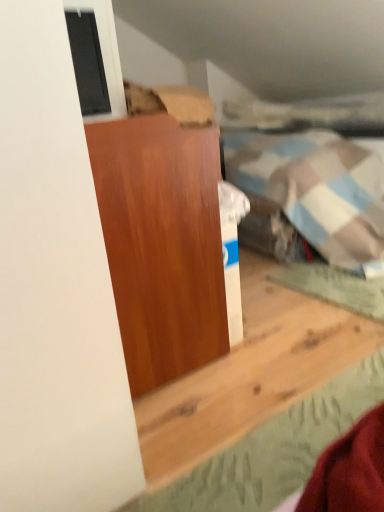
Question: Considering the relative positions of matte glass window at upper left and matte wood cabinet at center in the image provided, is matte glass window at upper left to the right of matte wood cabinet at center from the viewer's perspective?

Choices:
 (A) yes
 (B) no

Answer: (B)

Question: Does matte glass window at upper left have a larger size compared to matte wood cabinet at center?

Choices:
 (A) no
 (B) yes

Answer: (A)

Question: Is matte glass window at upper left to the left of matte wood cabinet at center from the viewer's perspective?

Choices:
 (A) yes
 (B) no

Answer: (A)

Question: Considering the relative sizes of matte glass window at upper left and matte wood cabinet at center in the image provided, is matte glass window at upper left wider than matte wood cabinet at center?

Choices:
 (A) no
 (B) yes

Answer: (A)

Question: Would you consider matte glass window at upper left to be distant from matte wood cabinet at center?

Choices:
 (A) no
 (B) yes

Answer: (A)

Question: Can you confirm if matte glass window at upper left is taller than matte wood cabinet at center?

Choices:
 (A) yes
 (B) no

Answer: (B)

Question: Is matte wood cabinet at center wider than matte glass window at upper left?

Choices:
 (A) no
 (B) yes

Answer: (B)

Question: Does matte wood cabinet at center have a lesser height compared to matte glass window at upper left?

Choices:
 (A) no
 (B) yes

Answer: (A)

Question: Considering the relative positions of matte wood cabinet at center and matte glass window at upper left in the image provided, is matte wood cabinet at center to the right of matte glass window at upper left from the viewer's perspective?

Choices:
 (A) yes
 (B) no

Answer: (A)

Question: Considering the relative positions of matte wood cabinet at center and matte glass window at upper left in the image provided, is matte wood cabinet at center to the left of matte glass window at upper left from the viewer's perspective?

Choices:
 (A) no
 (B) yes

Answer: (A)

Question: Is matte wood cabinet at center looking in the opposite direction of matte glass window at upper left?

Choices:
 (A) yes
 (B) no

Answer: (B)

Question: Are matte wood cabinet at center and matte glass window at upper left making contact?

Choices:
 (A) yes
 (B) no

Answer: (B)

Question: Considering their positions, is matte wood cabinet at center located in front of or behind matte glass window at upper left?

Choices:
 (A) behind
 (B) front

Answer: (B)